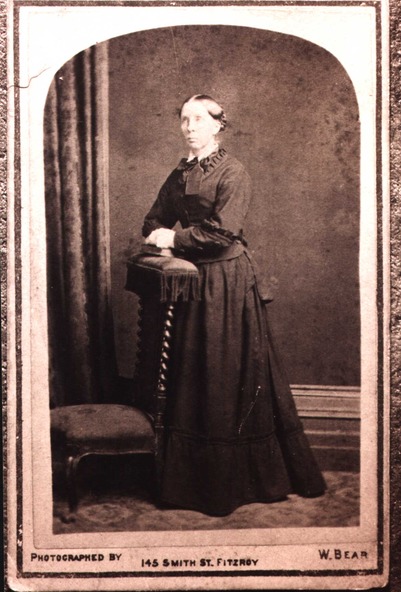
The width and height of the screenshot is (401, 592). In order to click on drapes in this screenshot , I will do `click(82, 185)`.